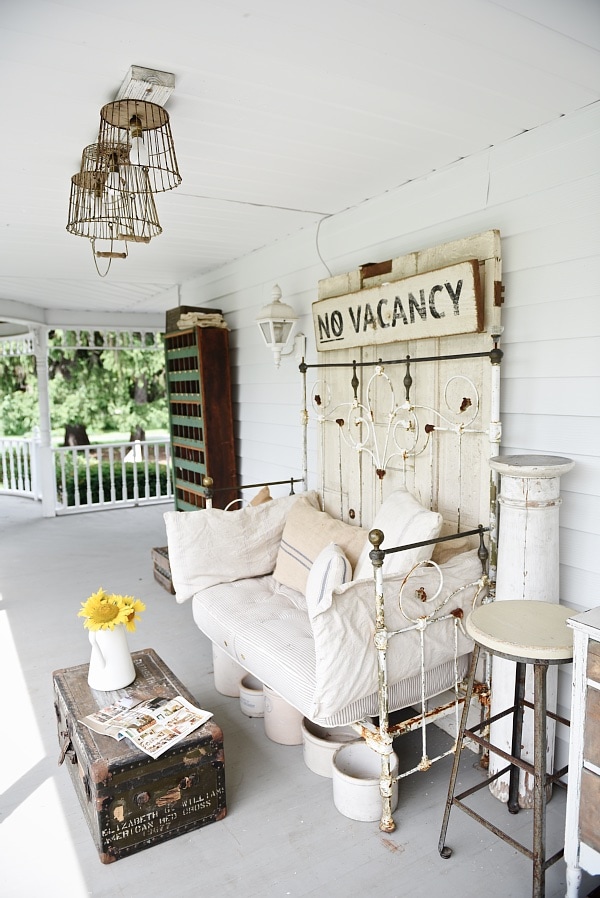
Identify the location of lights. The image size is (600, 898). (141, 146), (115, 185), (98, 199), (272, 331).